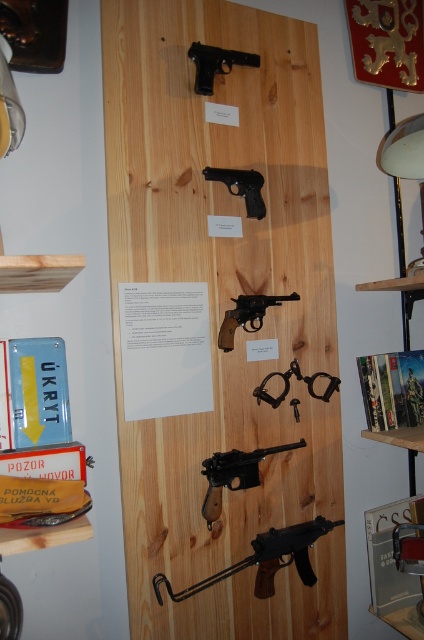
Question: Which object appears closest to the camera in this image?

Choices:
 (A) black matte handgun at center
 (B) black matte handgun at upper center
 (C) matte brown revolver at center

Answer: (A)

Question: Estimate the real-world distances between objects in this image. Which object is closer to the matte black pistol at center?

Choices:
 (A) matte brown revolver at center
 (B) white glossy lampshade at upper right

Answer: (A)

Question: Considering the relative positions of black matte handgun at upper center and matte brown revolver at center in the image provided, where is black matte handgun at upper center located with respect to matte brown revolver at center?

Choices:
 (A) right
 (B) left

Answer: (B)

Question: From the image, what is the correct spatial relationship of wooden signboard at center in relation to black matte handgun at center?

Choices:
 (A) left
 (B) right

Answer: (A)

Question: Can you confirm if white glossy lampshade at upper right is thinner than black matte handgun at upper center?

Choices:
 (A) no
 (B) yes

Answer: (B)

Question: Which point is closer to the camera?

Choices:
 (A) (231, 298)
 (B) (228, 481)
 (C) (396, 138)

Answer: (B)